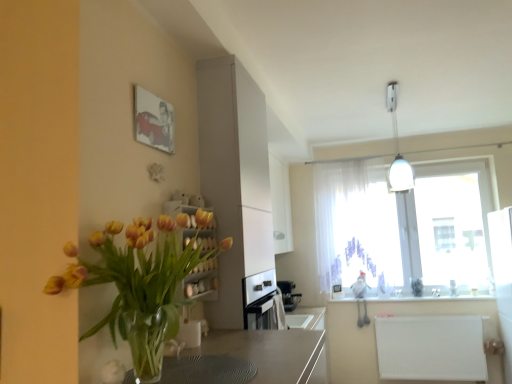
Question: Is matte canvas painting at upper left to the right of white matte radiator at lower right, the 2th counter top positioned from the top, from the viewer's perspective?

Choices:
 (A) yes
 (B) no

Answer: (B)

Question: Is matte canvas painting at upper left shorter than white matte radiator at lower right, the 2th counter top positioned from the top?

Choices:
 (A) no
 (B) yes

Answer: (B)

Question: Is matte canvas painting at upper left aimed at white matte radiator at lower right, the 2th counter top positioned from the top?

Choices:
 (A) no
 (B) yes

Answer: (A)

Question: Can you confirm if matte canvas painting at upper left is taller than white matte radiator at lower right, the 1th counter top in the bottom-to-top sequence?

Choices:
 (A) yes
 (B) no

Answer: (B)

Question: From a real-world perspective, is matte canvas painting at upper left located higher than white matte radiator at lower right, the 2th counter top positioned from the top?

Choices:
 (A) yes
 (B) no

Answer: (A)

Question: Is matte canvas painting at upper left bigger than white matte radiator at lower right, the 1th counter top in the bottom-to-top sequence?

Choices:
 (A) no
 (B) yes

Answer: (A)

Question: From the image's perspective, does white matte radiator at lower right, the 2th counter top positioned from the top, appear higher than matte canvas painting at upper left?

Choices:
 (A) yes
 (B) no

Answer: (B)

Question: From a real-world perspective, is white matte radiator at lower right, the 1th counter top in the bottom-to-top sequence, on top of matte canvas painting at upper left?

Choices:
 (A) no
 (B) yes

Answer: (A)

Question: From a real-world perspective, is white matte radiator at lower right, the 1th counter top in the bottom-to-top sequence, beneath matte canvas painting at upper left?

Choices:
 (A) no
 (B) yes

Answer: (B)

Question: Is white matte radiator at lower right, the 2th counter top positioned from the top, not inside matte canvas painting at upper left?

Choices:
 (A) yes
 (B) no

Answer: (A)

Question: Is white matte radiator at lower right, the 1th counter top in the bottom-to-top sequence, far from matte canvas painting at upper left?

Choices:
 (A) no
 (B) yes

Answer: (B)

Question: From the image's perspective, is white matte radiator at lower right, the 1th counter top in the bottom-to-top sequence, under matte canvas painting at upper left?

Choices:
 (A) yes
 (B) no

Answer: (A)

Question: From a real-world perspective, is matte white cabinet at center beneath sleek metallic coffee machine at center?

Choices:
 (A) yes
 (B) no

Answer: (B)